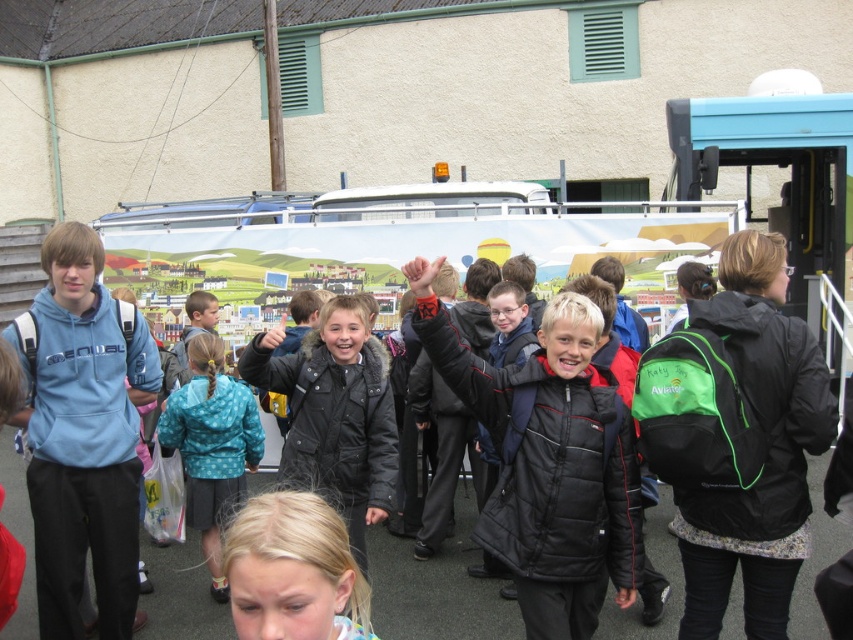
Question: Which of the following is the closest to the observer?

Choices:
 (A) black fuzzy jacket at center
 (B) blonde hair at lower center

Answer: (B)

Question: Which point is closer to the camera?

Choices:
 (A) (258, 538)
 (B) (229, 440)
 (C) (294, 474)

Answer: (A)

Question: Is black matte backpack at right thinner than black fuzzy jacket at center?

Choices:
 (A) no
 (B) yes

Answer: (B)

Question: Which point is closer to the camera taking this photo?

Choices:
 (A) (306, 432)
 (B) (302, 544)
 (C) (173, 392)

Answer: (B)

Question: Observing the image, what is the correct spatial positioning of black matte backpack at right in reference to blue dotted jacket at center?

Choices:
 (A) below
 (B) above

Answer: (B)

Question: Can you confirm if black fuzzy jacket at center is positioned above blue dotted jacket at center?

Choices:
 (A) no
 (B) yes

Answer: (B)